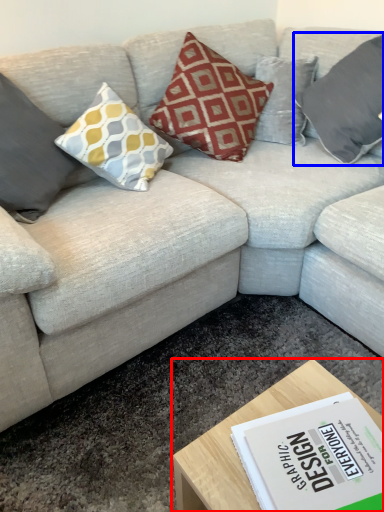
Question: Which point is further to the camera, coffee table (highlighted by a red box) or pillow (highlighted by a blue box)?

Choices:
 (A) coffee table
 (B) pillow

Answer: (B)